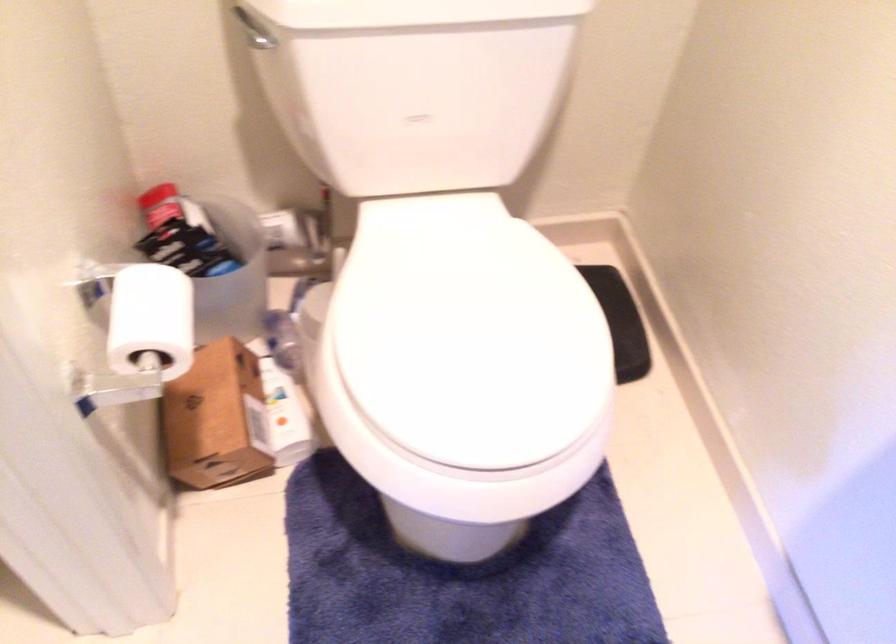
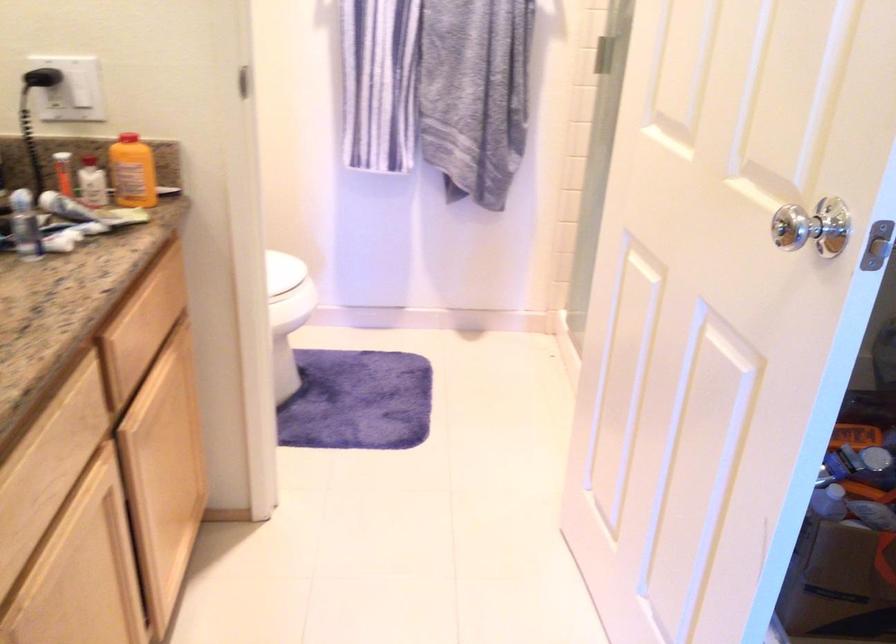
Question: I am providing you with two images of the same scene from different viewpoints. Please identify which objects are invisible in image2.

Choices:
 (A) white plastic bottle
 (B) white toothpaste tube
 (C) white leg clamp
 (D) black electrical plug

Answer: (A)